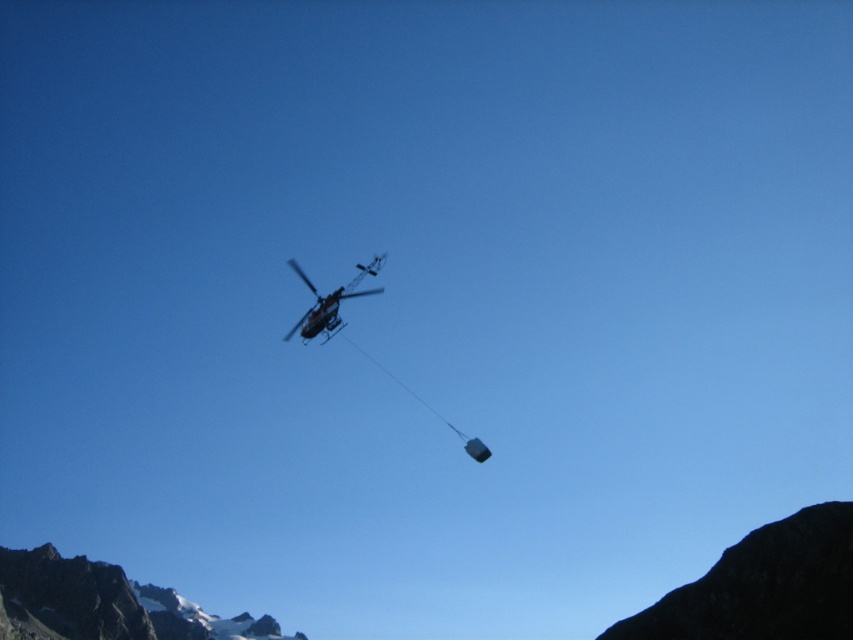
Can you confirm if black rocky mountain at lower right is smaller than metallic silver helicopter at center?

Yes, black rocky mountain at lower right is smaller than metallic silver helicopter at center.

Who is shorter, black rocky mountain at lower right or metallic silver helicopter at center?

Standing shorter between the two is black rocky mountain at lower right.

Where is `black rocky mountain at lower right`? Image resolution: width=853 pixels, height=640 pixels. black rocky mountain at lower right is located at coordinates (763, 586).